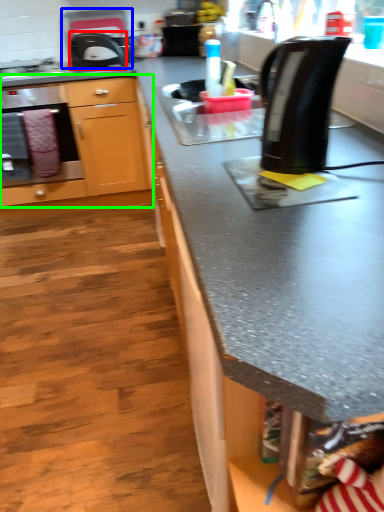
Question: Which object is the closest to the kitchen appliance (highlighted by a red box)? Choose among these: appliance (highlighted by a blue box) or cabinetry (highlighted by a green box).

Choices:
 (A) appliance
 (B) cabinetry

Answer: (A)